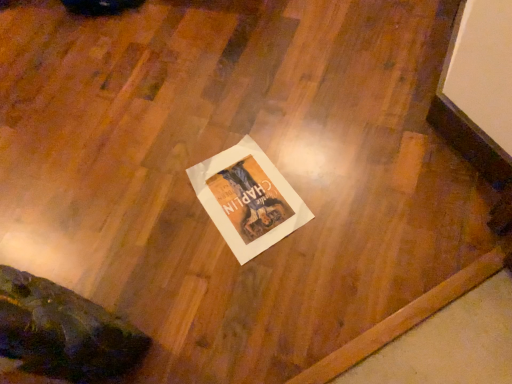
You are a GUI agent. You are given a task and a screenshot of the screen. Output one action in this format:
    pyautogui.click(x=<x>, y=<y>)
    Task: Click on the vacant space situated on the left part of white paper poster at center
    This screenshot has width=512, height=384.
    Given the screenshot: What is the action you would take?
    pyautogui.click(x=167, y=245)